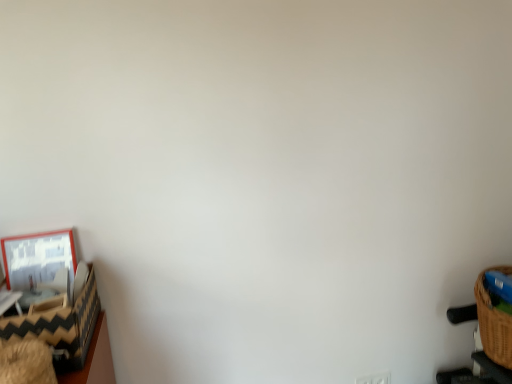
Question: In terms of width, does black and white zigzag-patterned basket at left look wider or thinner when compared to matte wooden picture frame at left?

Choices:
 (A) wide
 (B) thin

Answer: (A)

Question: From the image's perspective, is black and white zigzag-patterned basket at left above or below matte wooden picture frame at left?

Choices:
 (A) above
 (B) below

Answer: (B)

Question: Based on their relative distances, which object is farther from the white plastic electric outlet at lower right?

Choices:
 (A) matte wooden picture frame at left
 (B) black and white zigzag-patterned basket at left

Answer: (A)

Question: Estimate the real-world distances between objects in this image. Which object is closer to the matte wooden picture frame at left?

Choices:
 (A) white plastic electric outlet at lower right
 (B) black and white zigzag-patterned basket at left

Answer: (B)